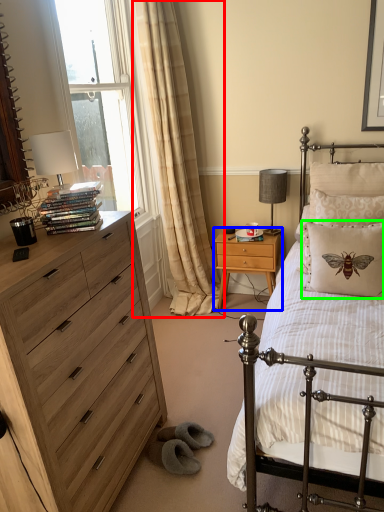
Question: Which object is positioned closest to curtain (highlighted by a red box)? Select from nightstand (highlighted by a blue box) and pillow (highlighted by a green box).

Choices:
 (A) nightstand
 (B) pillow

Answer: (A)